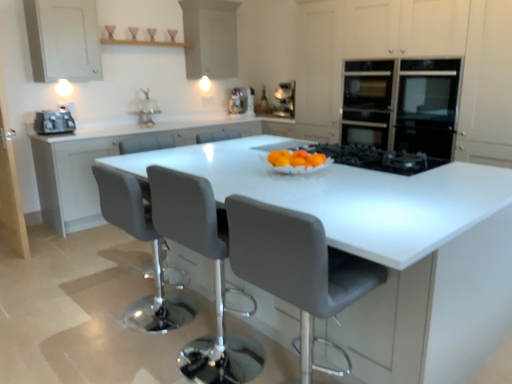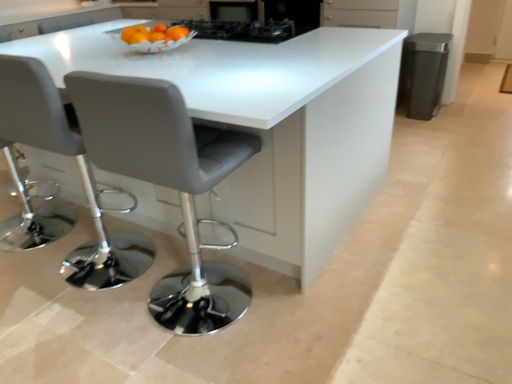
Question: How did the camera likely rotate when shooting the video?

Choices:
 (A) rotated right
 (B) rotated left

Answer: (A)